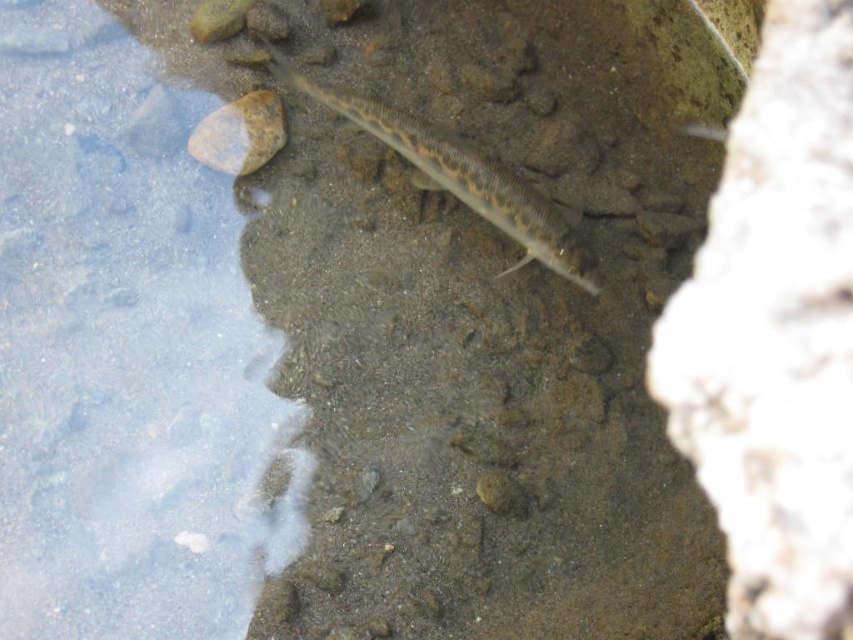
You are an underwater photographer aiming to capture the sandy brown fish at center. You notice a brown rough rock at upper left in the background. Based on their sizes, which object would block more light when positioned between the camera and the light source?

The sandy brown fish at center has a larger width than the brown rough rock at upper left, so it would block more light when positioned between the camera and the light source.

Looking at this image, you are a small frog trying to jump from the brown rough rock at upper left to the clear water at left. Based on the scene, can you safely make the jump?

The clear water at left is larger in size than brown rough rock at upper left, so yes, the frog can safely jump from the brown rough rock at upper left to the clear water at left since the water has enough space to land in.

You are a fisherman trying to catch the fish in the shallow water. You see a point marked at coordinates (125, 353). Where is this point located in relation to the clear water at left?

The point marked at (125, 353) is located on the clear water at left.